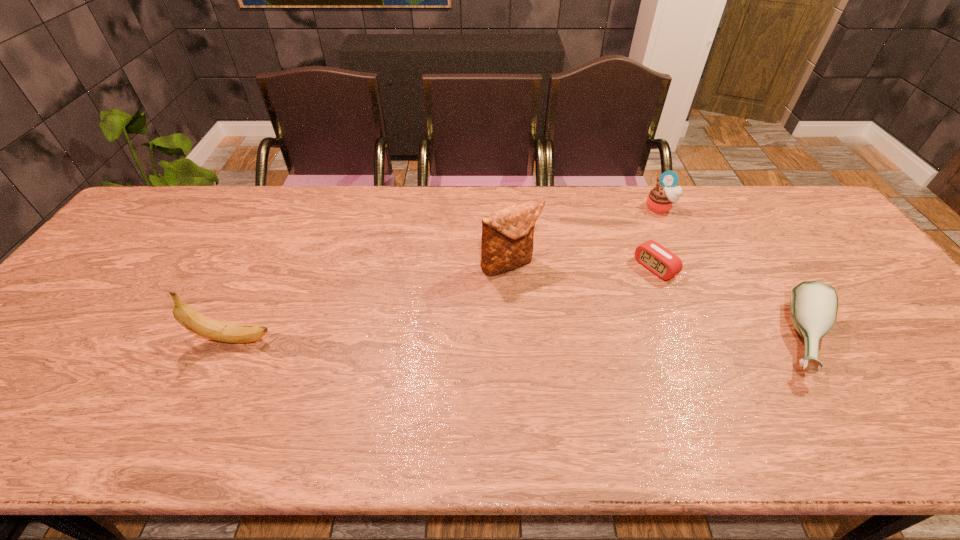
Find the location of a particular element. The width and height of the screenshot is (960, 540). vacant space located on the open side of the clutch bag is located at coordinates (566, 344).

Where is `vacant region located 0.140m on the open side of the clutch bag`? This screenshot has height=540, width=960. vacant region located 0.140m on the open side of the clutch bag is located at coordinates (547, 314).

Find the location of a particular element. vacant area situated 0.260m on the front-facing side of the alarm clock is located at coordinates (573, 319).

Where is `vacant space located 0.300m on the front-facing side of the alarm clock`? This screenshot has width=960, height=540. vacant space located 0.300m on the front-facing side of the alarm clock is located at coordinates (x=562, y=327).

I want to click on vacant space located on the front-facing side of the alarm clock, so [x=576, y=318].

This screenshot has width=960, height=540. I want to click on blank space located on the front-facing side of the muffin, so (x=627, y=252).

Find the location of a particular element. The height and width of the screenshot is (540, 960). vacant space located 0.050m on the front-facing side of the muffin is located at coordinates (649, 222).

Find the location of `vacant space located on the front-facing side of the muffin`. vacant space located on the front-facing side of the muffin is located at coordinates (631, 246).

You are a GUI agent. You are given a task and a screenshot of the screen. Output one action in this format:
    pyautogui.click(x=<x>, y=<y>)
    Task: Click on the object located at the far edge
    This screenshot has height=540, width=960.
    Given the screenshot: What is the action you would take?
    pyautogui.click(x=661, y=199)

The height and width of the screenshot is (540, 960). In order to click on object at the near edge in this screenshot , I will do `click(813, 304)`.